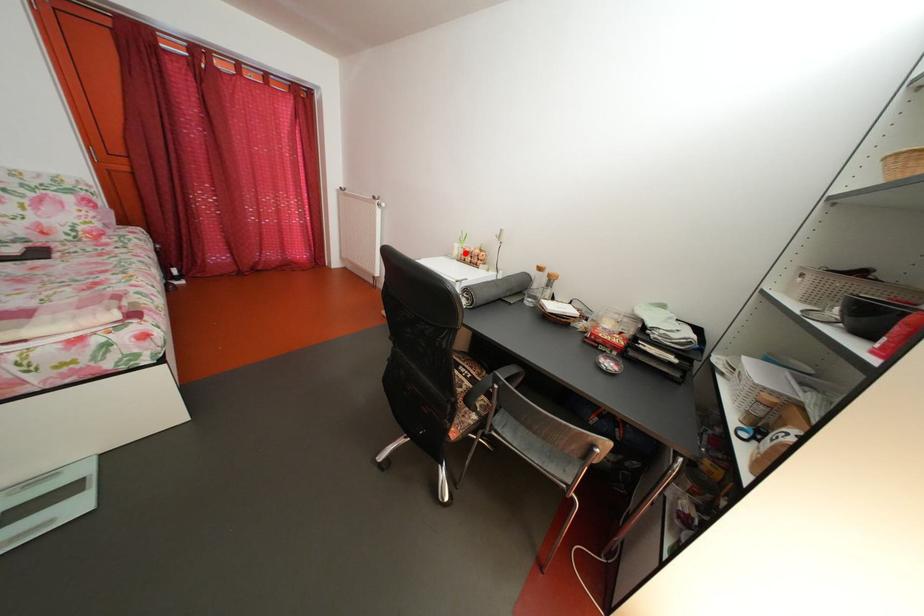
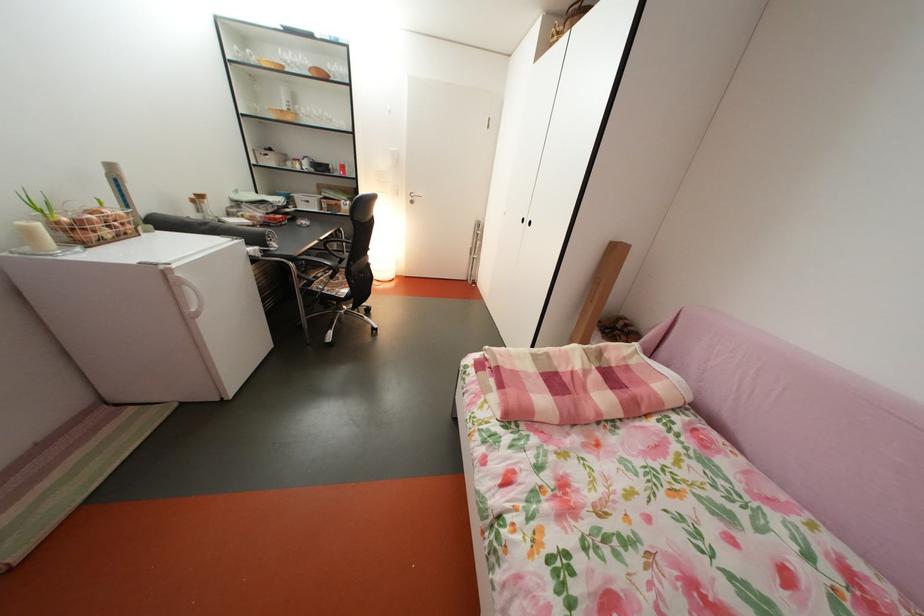
Question: I am providing you with two images of the same scene from different viewpoints. In image1, a red point is highlighted. Considering the same 3D point in image2, which of the following is correct?

Choices:
 (A) It is closer
 (B) It is farther

Answer: (B)